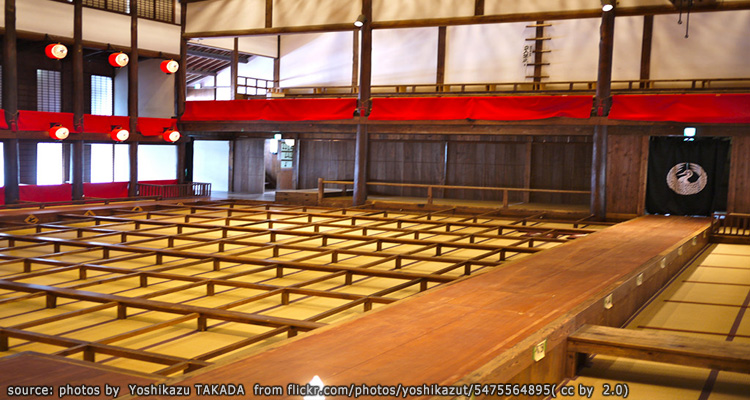
This screenshot has width=750, height=400. In order to click on wooden pillars in this screenshot , I will do `click(80, 64)`, `click(127, 77)`, `click(175, 80)`, `click(16, 75)`, `click(232, 69)`, `click(274, 71)`, `click(369, 49)`.